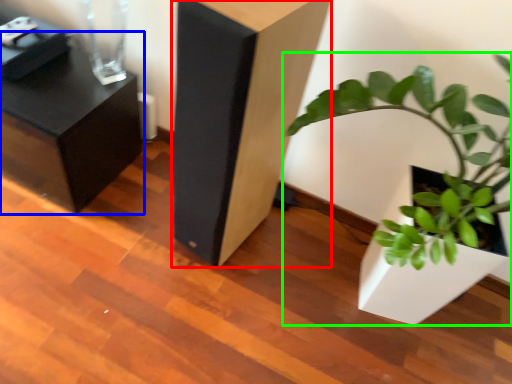
Question: Which object is the closest to the furniture (highlighted by a red box)? Choose among these: furniture (highlighted by a blue box) or houseplant (highlighted by a green box).

Choices:
 (A) furniture
 (B) houseplant

Answer: (B)